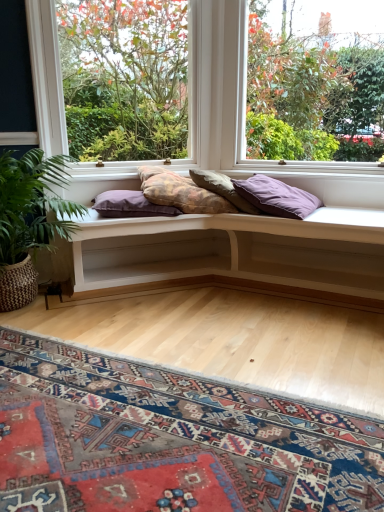
Question: Is textured beige pillow at center, acting as the second pillow starting from the right, positioned beyond the bounds of clear glass window at upper right, positioned as the second window in left-to-right order?

Choices:
 (A) yes
 (B) no

Answer: (A)

Question: Is textured beige pillow at center, acting as the second pillow starting from the right, oriented away from clear glass window at upper right, positioned as the second window in left-to-right order?

Choices:
 (A) no
 (B) yes

Answer: (A)

Question: From a real-world perspective, is textured beige pillow at center, the 3th pillow when ordered from left to right, positioned under clear glass window at upper right, positioned as the second window in left-to-right order, based on gravity?

Choices:
 (A) no
 (B) yes

Answer: (B)

Question: Does textured beige pillow at center, the 3th pillow when ordered from left to right, contain clear glass window at upper right, the first window positioned from the right?

Choices:
 (A) no
 (B) yes

Answer: (A)

Question: Considering the relative sizes of textured beige pillow at center, the 3th pillow when ordered from left to right, and clear glass window at upper right, positioned as the second window in left-to-right order, in the image provided, is textured beige pillow at center, the 3th pillow when ordered from left to right, wider than clear glass window at upper right, positioned as the second window in left-to-right order,?

Choices:
 (A) no
 (B) yes

Answer: (B)

Question: Can you confirm if textured beige pillow at center, the 3th pillow when ordered from left to right, is taller than clear glass window at upper right, positioned as the second window in left-to-right order?

Choices:
 (A) no
 (B) yes

Answer: (A)

Question: Is clear glass window at center, which is the 1th window in left-to-right order, at the right side of white wood bench at center?

Choices:
 (A) no
 (B) yes

Answer: (A)

Question: Does clear glass window at center, which is the 2th window in right-to-left order, have a greater height compared to white wood bench at center?

Choices:
 (A) no
 (B) yes

Answer: (B)

Question: Is clear glass window at center, which is the 1th window in left-to-right order, touching white wood bench at center?

Choices:
 (A) yes
 (B) no

Answer: (B)

Question: From a real-world perspective, is clear glass window at center, which is the 2th window in right-to-left order, under white wood bench at center?

Choices:
 (A) no
 (B) yes

Answer: (A)

Question: Does clear glass window at center, which is the 2th window in right-to-left order, appear on the left side of white wood bench at center?

Choices:
 (A) yes
 (B) no

Answer: (A)

Question: Is clear glass window at center, which is the 2th window in right-to-left order, facing towards white wood bench at center?

Choices:
 (A) no
 (B) yes

Answer: (A)

Question: Considering the relative sizes of purple fabric pillow at center, placed as the fourth pillow when sorted from right to left, and clear glass window at upper right, the first window positioned from the right, in the image provided, is purple fabric pillow at center, placed as the fourth pillow when sorted from right to left, smaller than clear glass window at upper right, the first window positioned from the right,?

Choices:
 (A) yes
 (B) no

Answer: (A)